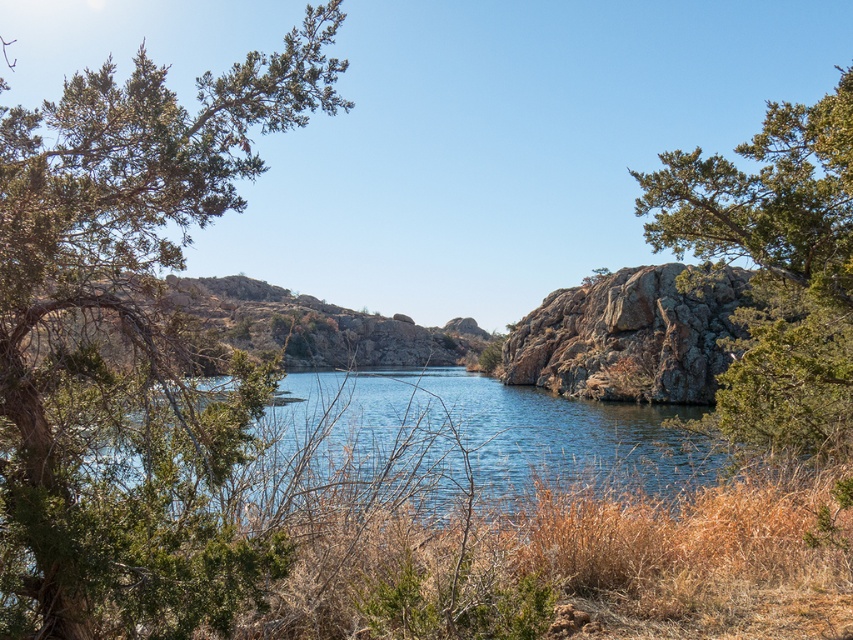
You are standing at the center of the scene and want to walk towards the green leafy tree at left. In which direction should you head?

The green leafy tree at left is located at point [131,348], which means it is positioned to the left side of the scene. Therefore, you should head towards the left direction to reach it.

You are a hiker trying to determine the tallest object between the green leafy tree at left and the rusty rock at center. Based on the scene, which one is taller?

The green leafy tree at left has a lesser height compared to the rusty rock at center, so the rusty rock at center is taller.